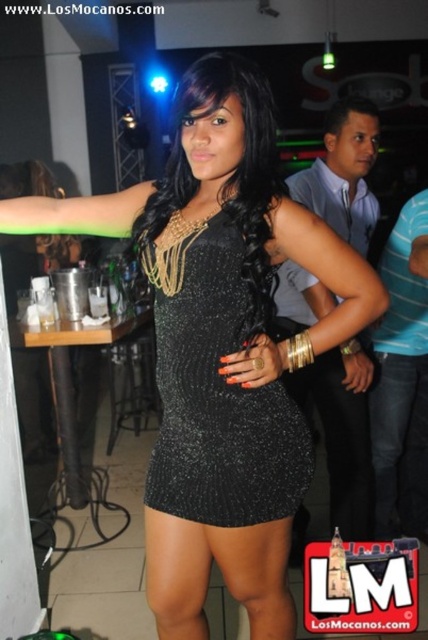
Question: Does black sequined dress at center have a smaller size compared to denim at right?

Choices:
 (A) yes
 (B) no

Answer: (A)

Question: Is black sequined dress at center positioned in front of denim at right?

Choices:
 (A) yes
 (B) no

Answer: (A)

Question: Is black sequined dress at center above denim at right?

Choices:
 (A) yes
 (B) no

Answer: (A)

Question: Among these points, which one is farthest from the camera?

Choices:
 (A) (416, 444)
 (B) (204, 289)

Answer: (A)